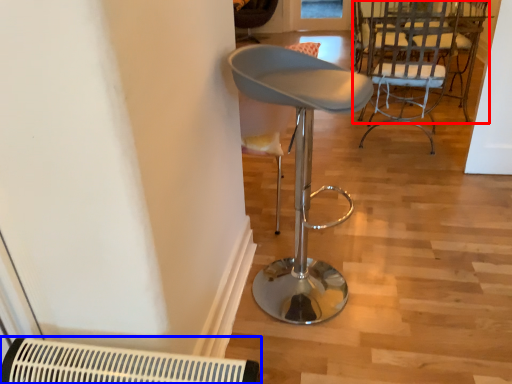
Question: Which object appears closest to the camera in this image, chair (highlighted by a red box) or air conditioning (highlighted by a blue box)?

Choices:
 (A) chair
 (B) air conditioning

Answer: (B)